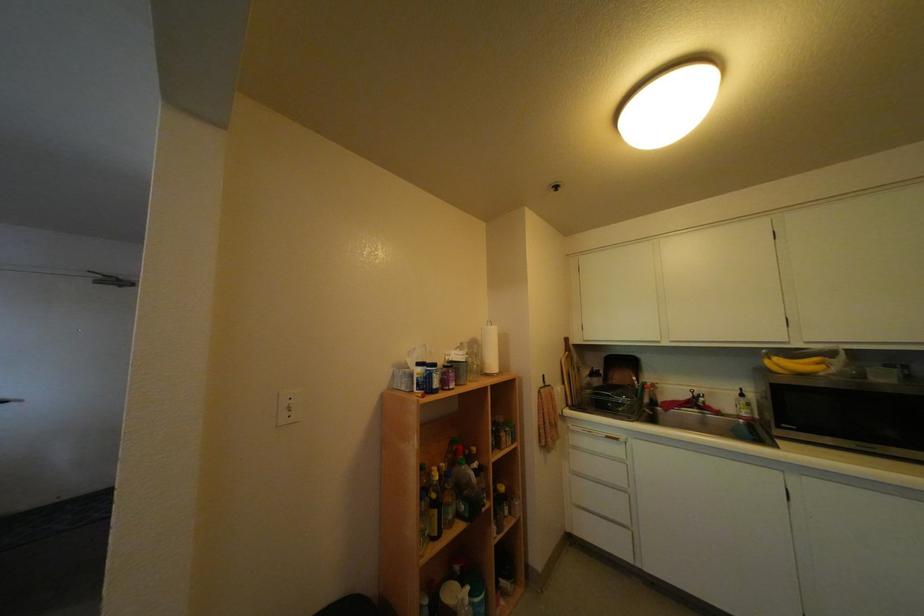
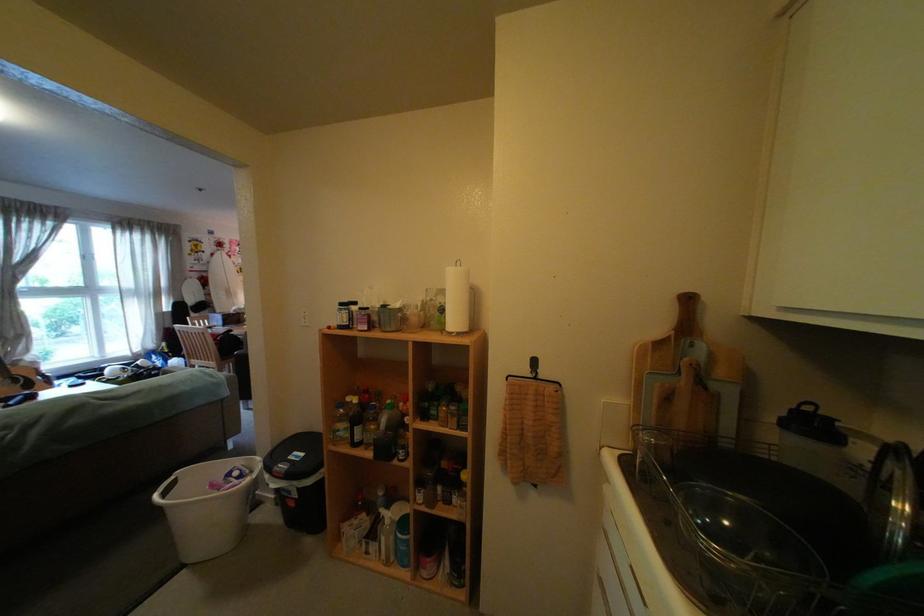
The point at (x=590, y=365) is marked in the first image. Where is the corresponding point in the second image?

(704, 367)